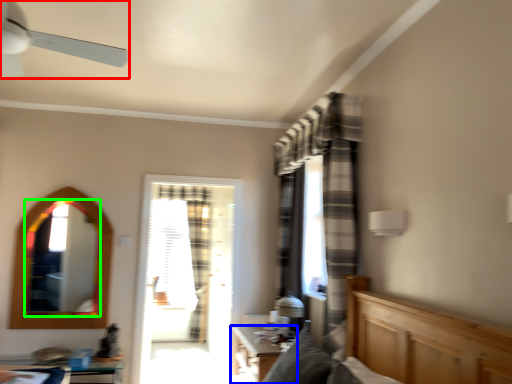
Question: Considering the real-world distances, which object is closest to ceiling fan (highlighted by a red box)? table (highlighted by a blue box) or mirror (highlighted by a green box).

Choices:
 (A) table
 (B) mirror

Answer: (B)